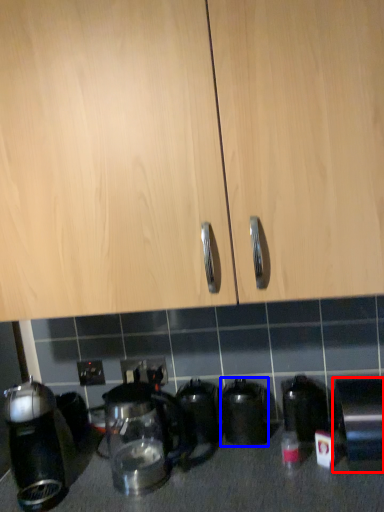
Question: Which object is closer to the camera taking this photo, kitchen appliance (highlighted by a red box) or kitchen appliance (highlighted by a blue box)?

Choices:
 (A) kitchen appliance
 (B) kitchen appliance

Answer: (A)